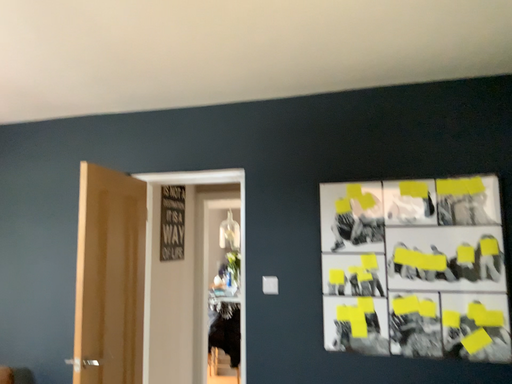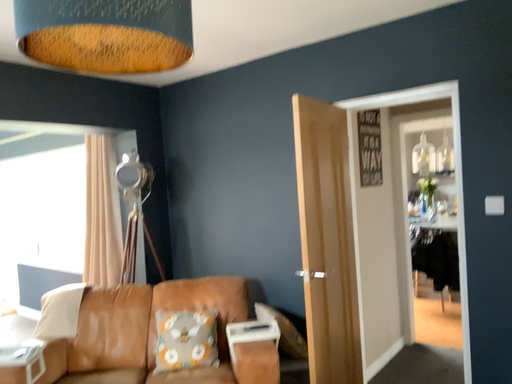
Question: How did the camera likely rotate when shooting the video?

Choices:
 (A) rotated left
 (B) rotated right

Answer: (A)